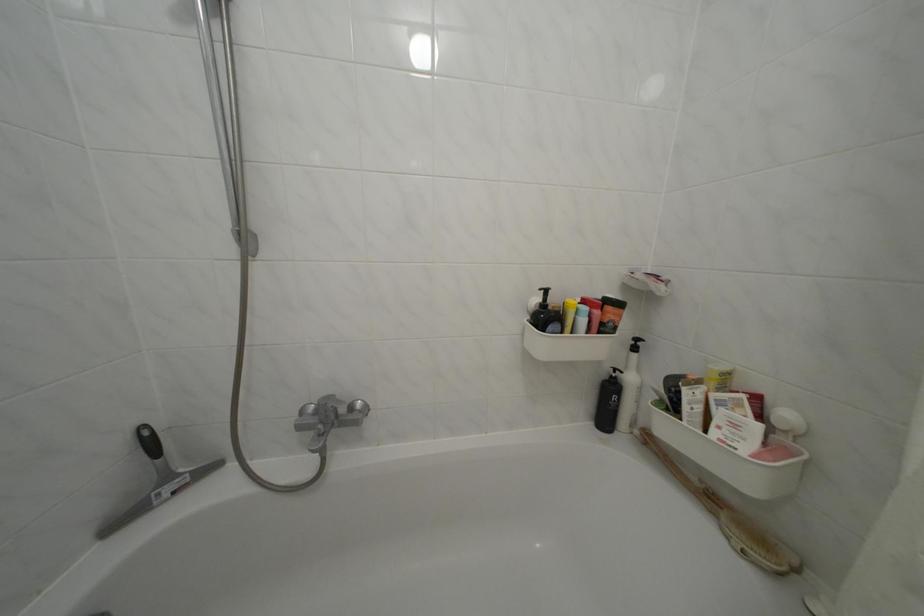
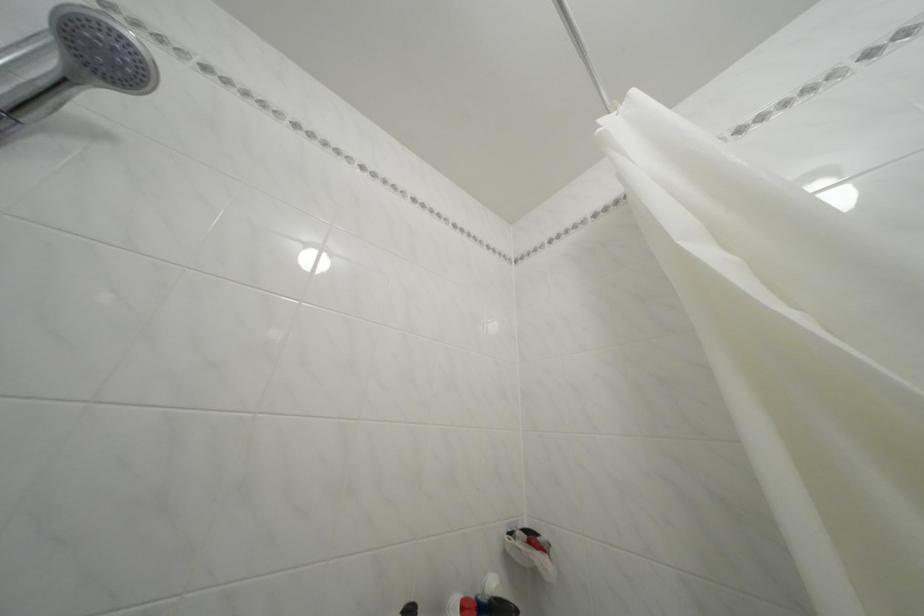
First-person continuous shooting, in which direction is the camera rotating?

The camera's rotation is toward right-up.